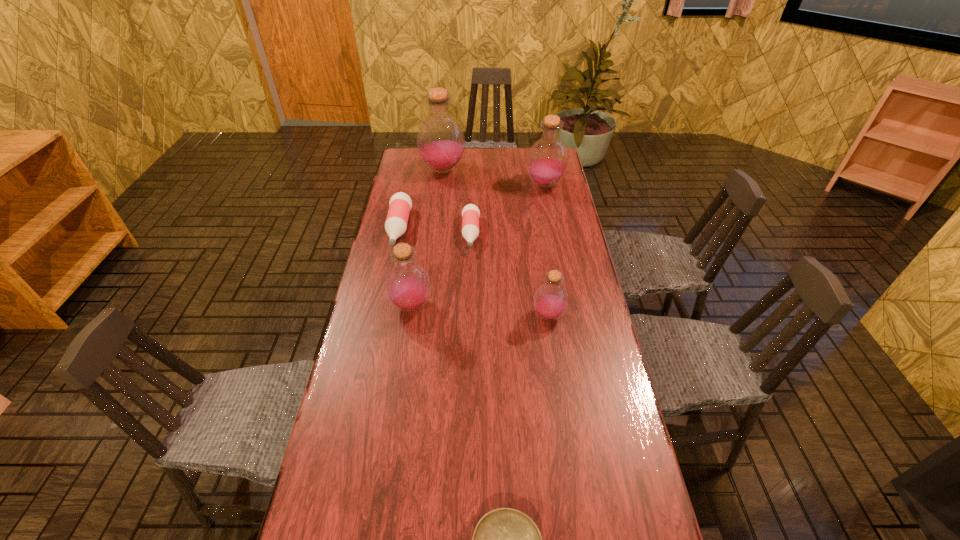
Locate which purple bottle ranks second in proximity to the gray bowl. Please provide its 2D coordinates. Your answer should be formatted as a tuple, i.e. [(x, y)], where the tuple contains the x and y coordinates of a point satisfying the conditions above.

[(407, 285)]

Select which pink bottle appears as the closest to the third smallest purple bottle. Please provide its 2D coordinates. Your answer should be formatted as a tuple, i.e. [(x, y)], where the tuple contains the x and y coordinates of a point satisfying the conditions above.

[(470, 214)]

Where is `the closest pink bottle to the gray bowl`? The width and height of the screenshot is (960, 540). the closest pink bottle to the gray bowl is located at coordinates (470, 214).

Find the location of a particular element. This screenshot has height=540, width=960. free space that satisfies the following two spatial constraints: 1. with the cap open on the fourth tallest object; 2. on the right side of the shortest bottle is located at coordinates (468, 316).